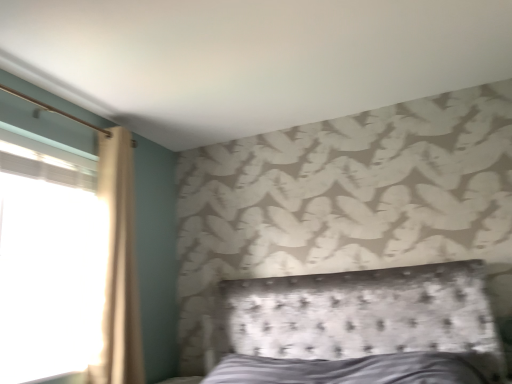
Question: From a real-world perspective, is beige fabric curtain at left positioned under transparent glass window at left based on gravity?

Choices:
 (A) no
 (B) yes

Answer: (A)

Question: Is the depth of beige fabric curtain at left greater than that of transparent glass window at left?

Choices:
 (A) yes
 (B) no

Answer: (A)

Question: Can you confirm if beige fabric curtain at left is bigger than transparent glass window at left?

Choices:
 (A) no
 (B) yes

Answer: (B)

Question: Is beige fabric curtain at left to the right of transparent glass window at left from the viewer's perspective?

Choices:
 (A) yes
 (B) no

Answer: (A)

Question: Is beige fabric curtain at left oriented towards transparent glass window at left?

Choices:
 (A) no
 (B) yes

Answer: (A)

Question: Is beige fabric curtain at left positioned before transparent glass window at left?

Choices:
 (A) yes
 (B) no

Answer: (B)

Question: Is transparent glass window at left closer to the viewer compared to beige fabric curtain at left?

Choices:
 (A) yes
 (B) no

Answer: (A)

Question: Considering the relative sizes of transparent glass window at left and beige fabric curtain at left in the image provided, is transparent glass window at left shorter than beige fabric curtain at left?

Choices:
 (A) yes
 (B) no

Answer: (A)

Question: From the image's perspective, is transparent glass window at left beneath beige fabric curtain at left?

Choices:
 (A) no
 (B) yes

Answer: (B)

Question: Are transparent glass window at left and beige fabric curtain at left far apart?

Choices:
 (A) yes
 (B) no

Answer: (B)

Question: Does transparent glass window at left have a lesser width compared to beige fabric curtain at left?

Choices:
 (A) yes
 (B) no

Answer: (A)

Question: Is transparent glass window at left at the left side of beige fabric curtain at left?

Choices:
 (A) yes
 (B) no

Answer: (A)

Question: Is beige fabric curtain at left bigger or smaller than transparent glass window at left?

Choices:
 (A) big
 (B) small

Answer: (A)